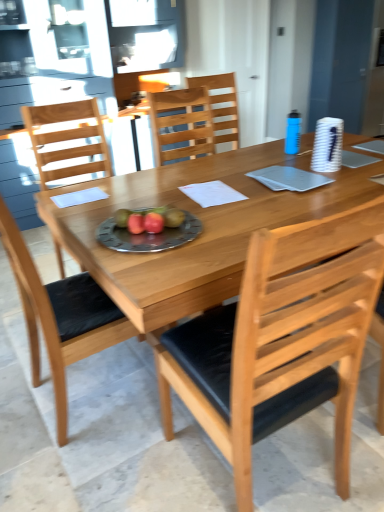
Where is `spots to the right of red matte apple at center, placed as the second fruit when sorted from right to left`? The height and width of the screenshot is (512, 384). spots to the right of red matte apple at center, placed as the second fruit when sorted from right to left is located at coordinates (184, 230).